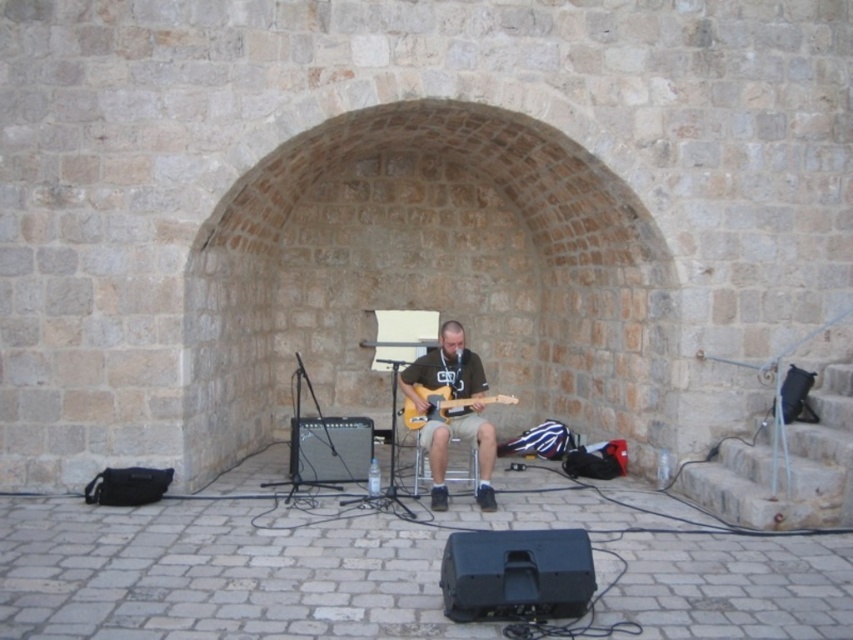
Who is more forward, (467, 360) or (415, 406)?

Point (415, 406) is more forward.

Locate an element on the screen. The height and width of the screenshot is (640, 853). matte black guitar at center is located at coordinates (445, 452).